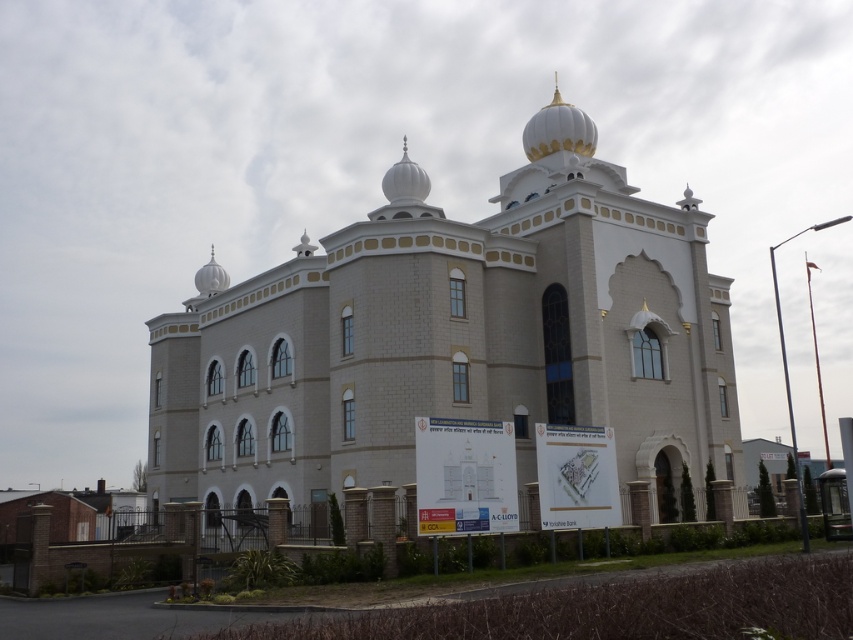
Does white stone church at center appear over white glossy dome at upper center?

Actually, white stone church at center is below white glossy dome at upper center.

Is white stone church at center to the left of white glossy dome at upper center from the viewer's perspective?

Yes, white stone church at center is to the left of white glossy dome at upper center.

Where is `white stone church at center`? white stone church at center is located at coordinates (450, 342).